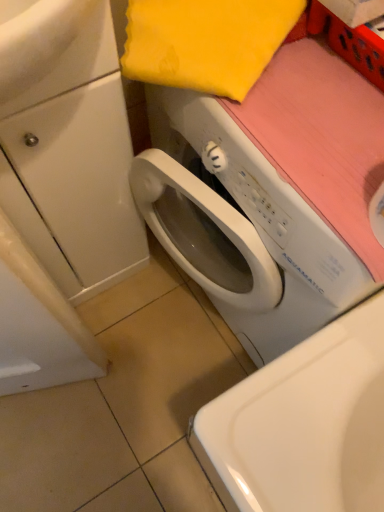
Where is `white plastic washing machine at center`? white plastic washing machine at center is located at coordinates (240, 226).

Between white plastic washing machine at center and white glossy cabinet at left, which one has larger width?

With larger width is white plastic washing machine at center.

Considering the positions of objects white plastic washing machine at center and white glossy cabinet at left in the image provided, who is behind, white plastic washing machine at center or white glossy cabinet at left?

white glossy cabinet at left.

Measure the distance between white plastic washing machine at center and white glossy cabinet at left.

white plastic washing machine at center is 19.55 centimeters away from white glossy cabinet at left.

Is white plastic washing machine at center looking in the opposite direction of white glossy cabinet at left?

No, white plastic washing machine at center is not facing away from white glossy cabinet at left.

From the image's perspective, is white glossy sink at upper left over white plastic washing machine at center?

Yes.

Looking at this image, considering the relative sizes of white glossy sink at upper left and white plastic washing machine at center in the image provided, is white glossy sink at upper left thinner than white plastic washing machine at center?

Yes, white glossy sink at upper left is thinner than white plastic washing machine at center.

Does white glossy sink at upper left have a lesser height compared to white plastic washing machine at center?

Yes, white glossy sink at upper left is shorter than white plastic washing machine at center.

This screenshot has width=384, height=512. Find the location of `sink above the white plastic washing machine at center (from a real-world perspective)`. sink above the white plastic washing machine at center (from a real-world perspective) is located at coordinates (75, 63).

From a real-world perspective, who is located higher, white glossy cabinet at left or white glossy sink at upper left?

From a 3D spatial view, white glossy sink at upper left is above.

Is white glossy cabinet at left next to white glossy sink at upper left?

white glossy cabinet at left and white glossy sink at upper left are not in contact.

Between white glossy cabinet at left and white glossy sink at upper left, which one is positioned in front?

white glossy sink at upper left.

Looking at their sizes, would you say white glossy cabinet at left is wider or thinner than white glossy sink at upper left?

In the image, white glossy cabinet at left appears to be more narrow than white glossy sink at upper left.

Is white glossy cabinet at left turned away from white plastic washing machine at center?

No, white plastic washing machine at center is not at the back of white glossy cabinet at left.

Considering the positions of objects white glossy cabinet at left and white plastic washing machine at center in the image provided, who is behind, white glossy cabinet at left or white plastic washing machine at center?

white glossy cabinet at left is more distant.

From a real-world perspective, which object stands above the other?

white glossy cabinet at left.

Considering the relative positions of white glossy cabinet at left and white plastic washing machine at center in the image provided, is white glossy cabinet at left to the left or to the right of white plastic washing machine at center?

white glossy cabinet at left is positioned on white plastic washing machine at center's left side.

Considering the relative positions of white plastic washing machine at center and white glossy sink at upper left in the image provided, is white plastic washing machine at center to the right of white glossy sink at upper left from the viewer's perspective?

Yes.

Could you tell me if white plastic washing machine at center is facing white glossy sink at upper left?

No, white plastic washing machine at center does not turn towards white glossy sink at upper left.

Relative to white glossy sink at upper left, is white plastic washing machine at center in front or behind?

In the image, white plastic washing machine at center appears behind white glossy sink at upper left.

How distant is white plastic washing machine at center from white glossy sink at upper left?

white plastic washing machine at center and white glossy sink at upper left are 11.84 inches apart.

Which point is more distant from viewer, (109, 32) or (123, 224)?

Point (123, 224)

Between white glossy sink at upper left and white glossy cabinet at left, which one is positioned behind?

white glossy cabinet at left is behind.

Which of these two, white glossy sink at upper left or white glossy cabinet at left, is thinner?

With smaller width is white glossy cabinet at left.

I want to click on drawer on the left of white glossy sink at upper left, so click(74, 185).

The height and width of the screenshot is (512, 384). What are the coordinates of `drawer behind the white plastic washing machine at center` in the screenshot? It's located at (74, 185).

You are a GUI agent. You are given a task and a screenshot of the screen. Output one action in this format:
    pyautogui.click(x=<x>, y=<y>)
    Task: Click on the washing machine below the white glossy sink at upper left (from a real-world perspective)
    The height and width of the screenshot is (512, 384).
    Given the screenshot: What is the action you would take?
    pyautogui.click(x=240, y=226)

Estimate the real-world distances between objects in this image. Which object is closer to white glossy cabinet at left, white plastic washing machine at center or white glossy sink at upper left?

white plastic washing machine at center.

Considering their positions, is white plastic washing machine at center positioned further to white glossy sink at upper left than white glossy cabinet at left?

white plastic washing machine at center lies further to white glossy sink at upper left than the other object.

Considering their positions, is white glossy sink at upper left positioned further to white plastic washing machine at center than white glossy cabinet at left?

white glossy sink at upper left is further to white plastic washing machine at center.

Which object lies nearer to the anchor point white plastic washing machine at center, white glossy cabinet at left or white glossy sink at upper left?

white glossy cabinet at left is closer to white plastic washing machine at center.

Considering their positions, is white glossy cabinet at left positioned further to white glossy sink at upper left than white plastic washing machine at center?

white plastic washing machine at center is positioned further to the anchor white glossy sink at upper left.

From the image, which object appears to be farther from white glossy cabinet at left, white glossy sink at upper left or white plastic washing machine at center?

Based on the image, white glossy sink at upper left appears to be further to white glossy cabinet at left.

Locate an element on the screen. sink located between white glossy cabinet at left and white plastic washing machine at center in the left-right direction is located at coordinates (75, 63).